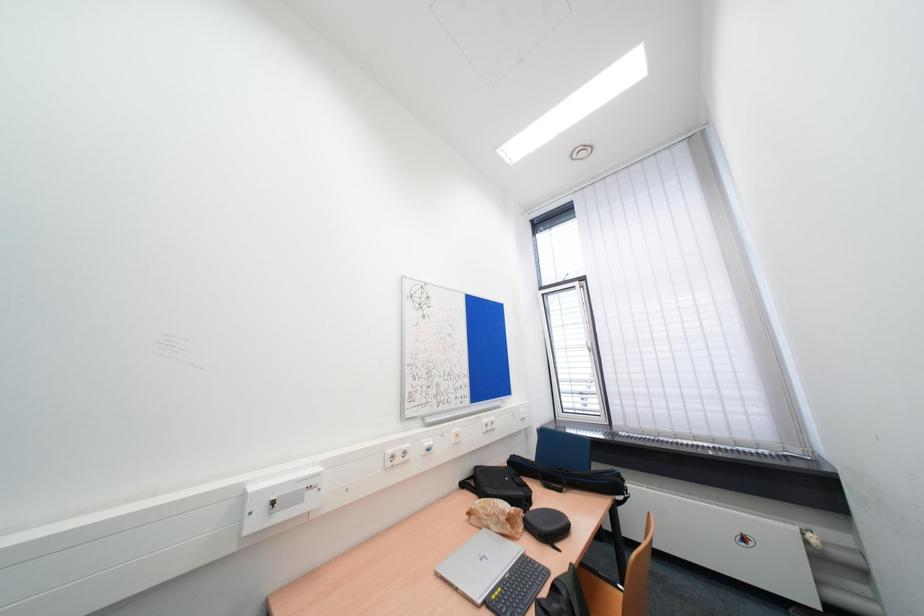
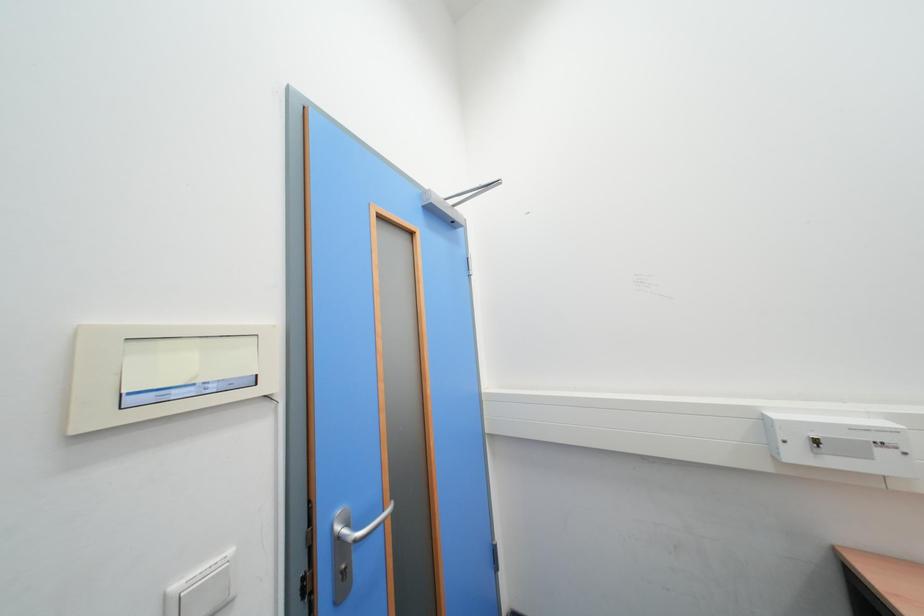
Question: The images are taken continuously from a first-person perspective. In which direction is your viewpoint rotating?

Choices:
 (A) Left
 (B) Right
 (C) Up
 (D) Down

Answer: (A)